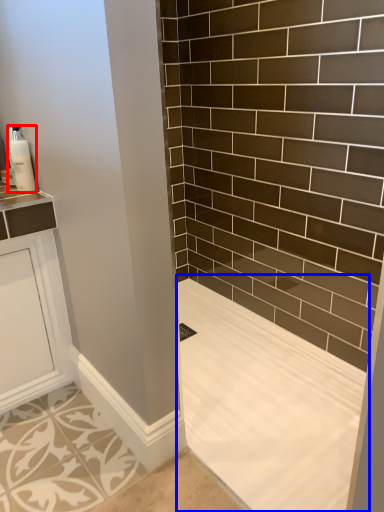
Question: Which point is closer to the camera, soap dispenser (highlighted by a red box) or bath (highlighted by a blue box)?

Choices:
 (A) soap dispenser
 (B) bath

Answer: (B)